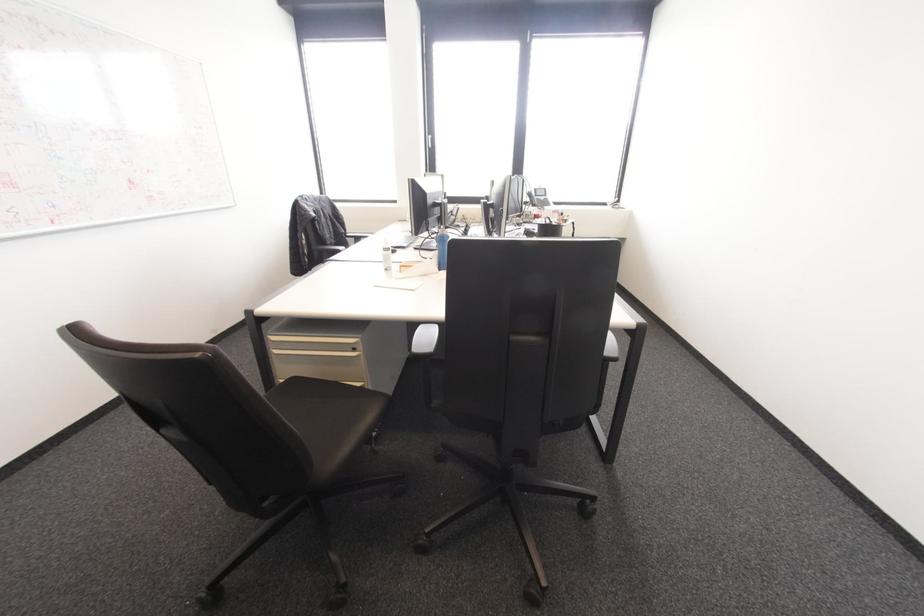
What do you see at coordinates (314, 400) in the screenshot? This screenshot has height=616, width=924. I see `a black chair sitting surface` at bounding box center [314, 400].